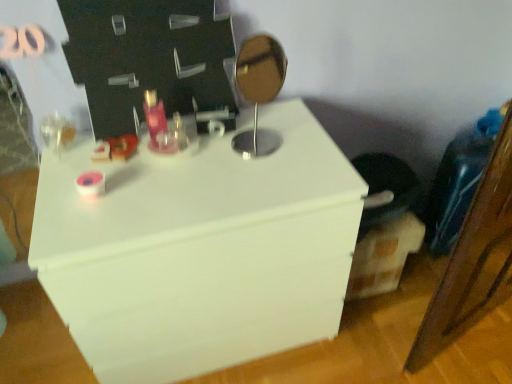
Where is `vacant space to the right of matte pink glass at center`? The image size is (512, 384). vacant space to the right of matte pink glass at center is located at coordinates (226, 157).